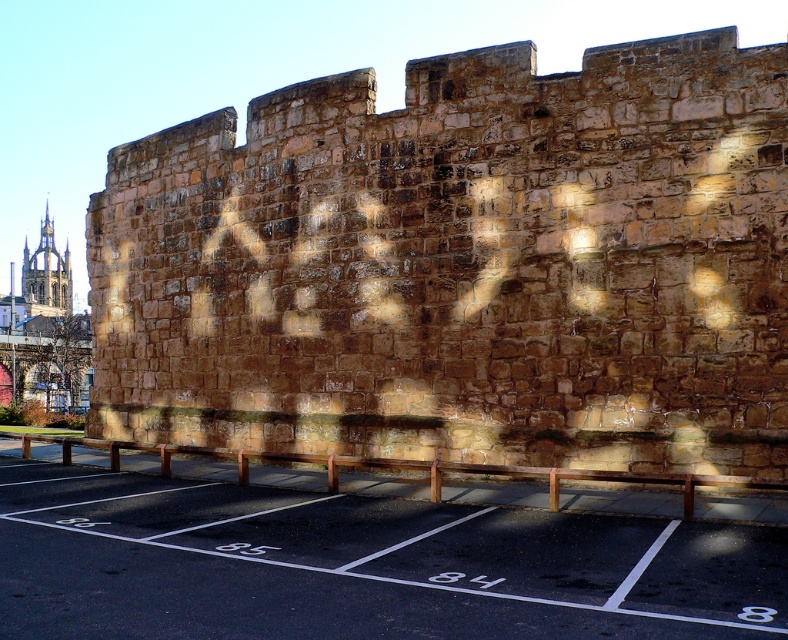
Looking at this image, you are standing at the point with coordinates (463, 266) in the image. What object is located at this point?

The brown stone wall at center is located at the point with coordinates (463, 266).

You are a tourist standing in front of the brown stone wall at center and the golden stone tower at upper left. Which object appears larger in the image?

The golden stone tower at upper left appears larger than the brown stone wall at center because the brown stone wall at center is smaller than golden stone tower at upper left.